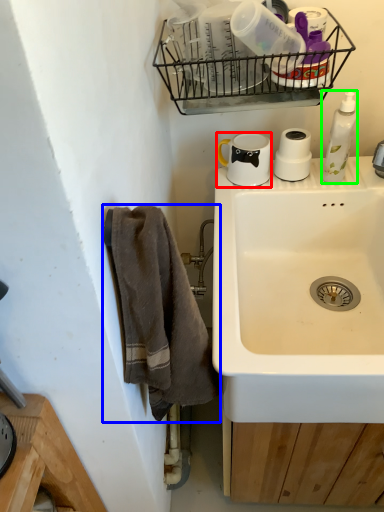
Question: Which object is positioned closest to coffee cup (highlighted by a red box)? Select from towel/napkin (highlighted by a blue box) and cleaning product (highlighted by a green box).

Choices:
 (A) towel/napkin
 (B) cleaning product

Answer: (B)